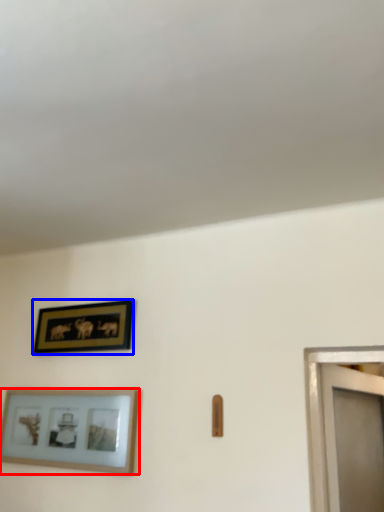
Question: Among these objects, which one is farthest to the camera, picture frame (highlighted by a red box) or picture frame (highlighted by a blue box)?

Choices:
 (A) picture frame
 (B) picture frame

Answer: (B)